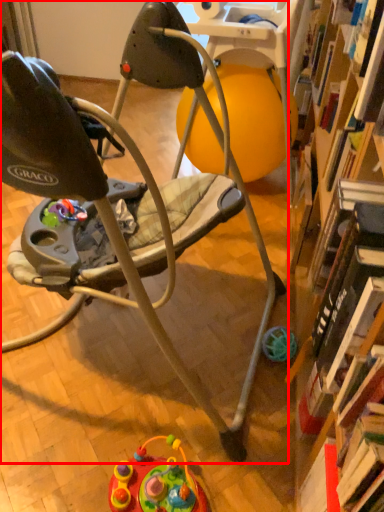
Question: In this image, where is chair (annotated by the red box) located relative to toy?

Choices:
 (A) right
 (B) left

Answer: (B)